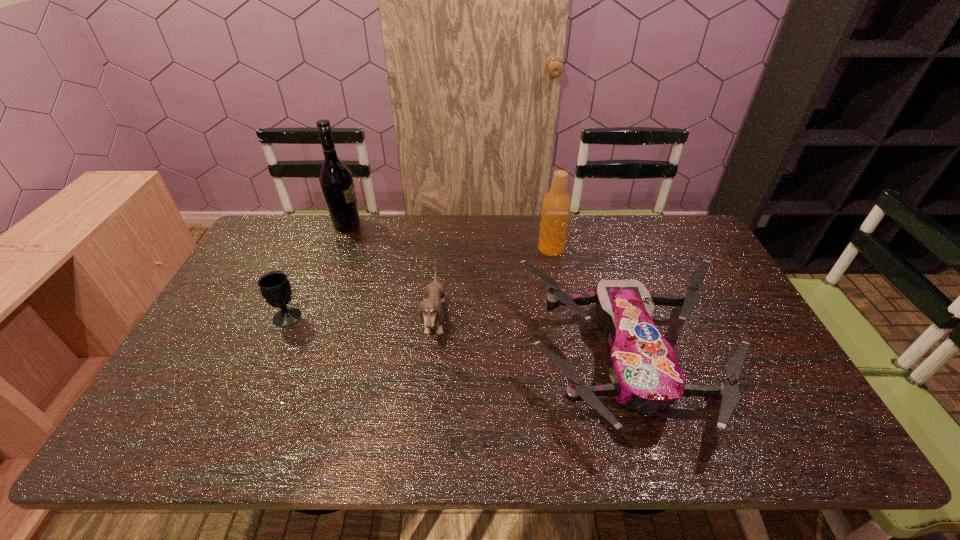
You are a GUI agent. You are given a task and a screenshot of the screen. Output one action in this format:
    pyautogui.click(x=<x>, y=<y>)
    Task: Click on the tallest object
    This screenshot has width=960, height=540.
    Given the screenshot: What is the action you would take?
    pyautogui.click(x=336, y=181)

You are a GUI agent. You are given a task and a screenshot of the screen. Output one action in this format:
    pyautogui.click(x=<x>, y=<y>)
    Task: Click on the wine bottle
    
    Given the screenshot: What is the action you would take?
    pyautogui.click(x=336, y=181)

Where is `the fourth shortest object`? Image resolution: width=960 pixels, height=540 pixels. the fourth shortest object is located at coordinates (556, 207).

Image resolution: width=960 pixels, height=540 pixels. Find the location of `beer bottle`. beer bottle is located at coordinates (556, 207).

Find the location of `chalice`. chalice is located at coordinates (275, 287).

Where is `puppy`? puppy is located at coordinates (432, 308).

You are a GUI agent. You are given a task and a screenshot of the screen. Output one action in this format:
    pyautogui.click(x=<x>, y=<y>)
    Task: Click on the drone
    Image resolution: width=960 pixels, height=540 pixels.
    Given the screenshot: What is the action you would take?
    pyautogui.click(x=645, y=374)

You are a GUI agent. You are given a task and a screenshot of the screen. Output one action in this format:
    pyautogui.click(x=<x>, y=<y>)
    Task: Click on the free space located on the label of the wine bottle
    This screenshot has height=540, width=960.
    Given the screenshot: What is the action you would take?
    pyautogui.click(x=378, y=224)

What are the coordinates of `vacant region located on the back of the second tallest object` in the screenshot? It's located at (544, 216).

Locate an element on the screen. vacant position located 0.210m on the right of the chalice is located at coordinates (375, 316).